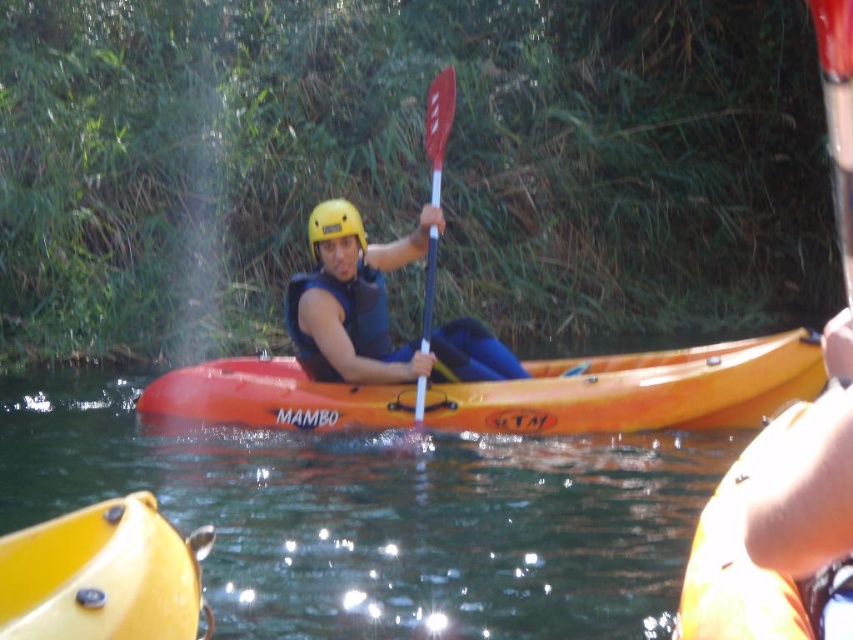
In the scene shown: Does yellow plastic canoe at lower left appear under red plastic paddle at center?

Yes, yellow plastic canoe at lower left is below red plastic paddle at center.

Between yellow plastic canoe at lower left and red plastic paddle at center, which one appears on the right side from the viewer's perspective?

red plastic paddle at center

Is point (119, 536) in front of point (430, 83)?

Yes, point (119, 536) is closer to viewer.

Locate an element on the screen. The width and height of the screenshot is (853, 640). yellow plastic canoe at lower left is located at coordinates (103, 576).

Is yellow plastic canoe at lower left to the right of matte blue life vest at center from the viewer's perspective?

No, yellow plastic canoe at lower left is not to the right of matte blue life vest at center.

Identify the location of yellow plastic canoe at lower left. The width and height of the screenshot is (853, 640). (103, 576).

This screenshot has width=853, height=640. Describe the element at coordinates (103, 576) in the screenshot. I see `yellow plastic canoe at lower left` at that location.

Locate an element on the screen. yellow plastic canoe at lower left is located at coordinates click(x=103, y=576).

Does transparent orange kayak at center have a lesser width compared to yellow matte helmet at center?

No, transparent orange kayak at center is not thinner than yellow matte helmet at center.

Does transparent orange kayak at center have a greater width compared to yellow matte helmet at center?

Yes.

Between point (107, 420) and point (318, 211), which one is positioned in front?

Point (318, 211)

This screenshot has width=853, height=640. I want to click on transparent orange kayak at center, so click(x=387, y=513).